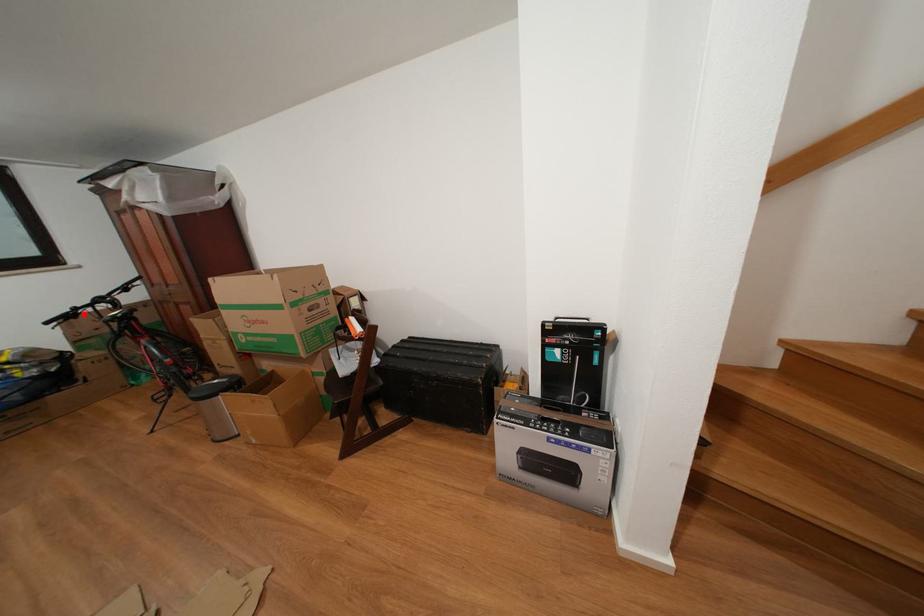
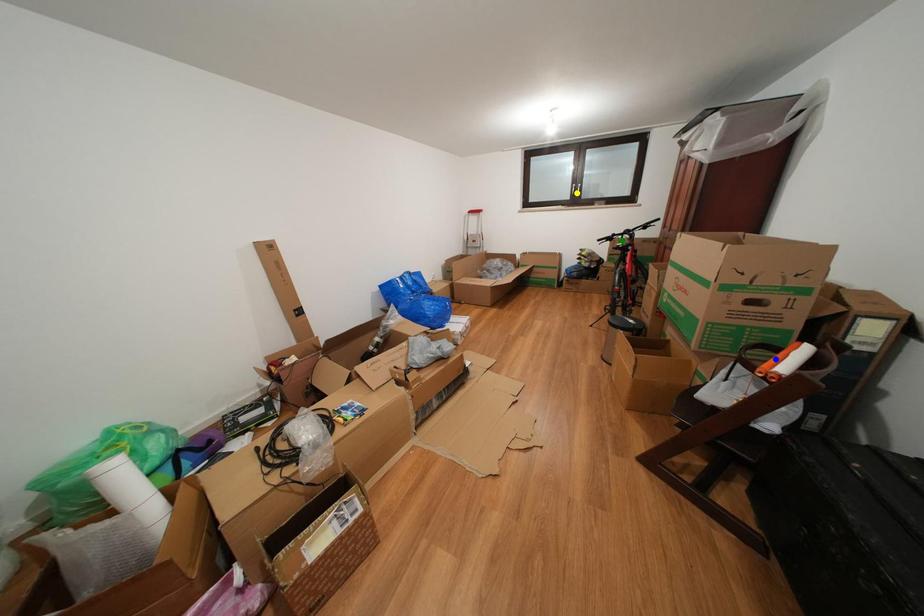
Question: I am providing you with two images of the same scene from different viewpoints. A red point is marked on the first image. You are given multiple points on the second image. Which point in image 2 represents the same 3d spot as the red point in image 1?

Choices:
 (A) blue point
 (B) green point
 (C) yellow point

Answer: (B)